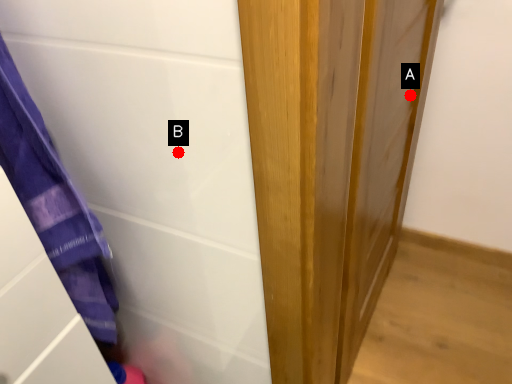
Question: Two points are circled on the image, labeled by A and B beside each circle. Among these points, which one is farthest from the camera?

Choices:
 (A) A is further
 (B) B is further

Answer: (A)